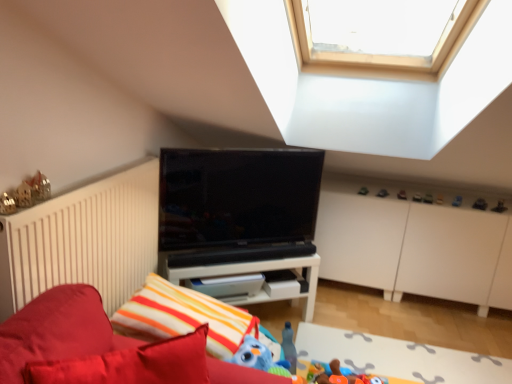
I want to click on free point to the right of matte black toy car at upper center, the 9th toy in the front-to-back sequence, so click(417, 192).